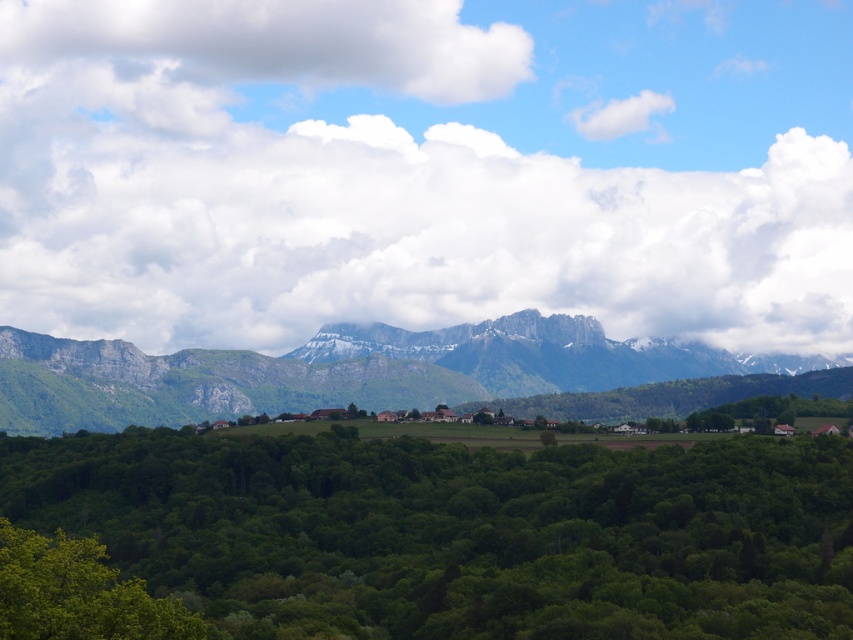
You are an artist sketching this landscape and want to ensure the green leafy trees at center and white fluffy cloud at upper left are proportionally accurate. Which object should you draw wider in your sketch?

The green leafy trees at center should be drawn wider in your sketch since their width is larger than the white fluffy cloud at upper left according to the description.

You are an airplane passenger looking out the window and see the green leafy trees at center and the white fluffy cloud at upper left. Which object is closer to the ground?

The green leafy trees at center are closer to the ground than the white fluffy cloud at upper left because they are positioned below it.